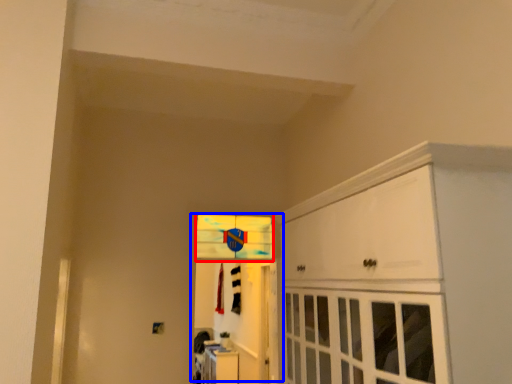
Question: Which object is closer to the camera taking this photo, window (highlighted by a red box) or door (highlighted by a blue box)?

Choices:
 (A) window
 (B) door

Answer: (B)